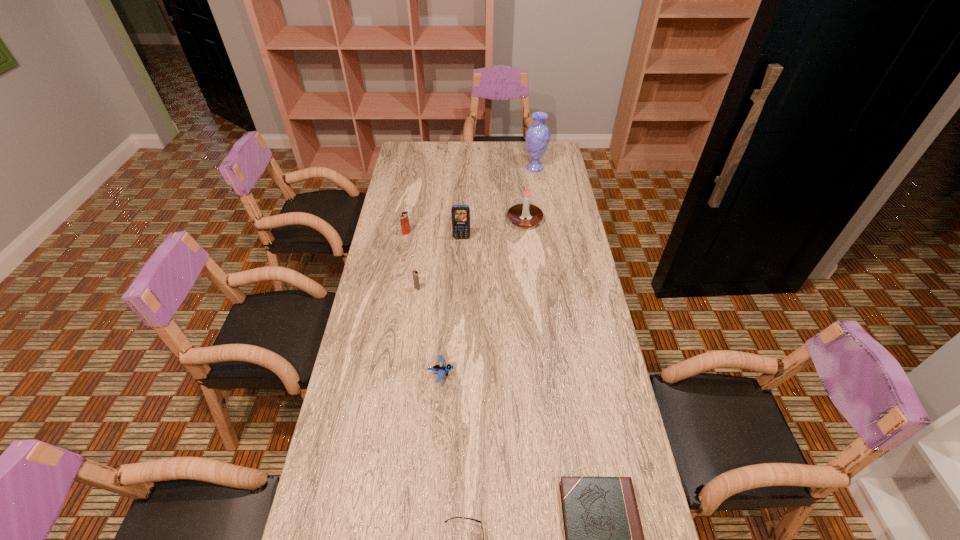
The height and width of the screenshot is (540, 960). Find the location of `object that is at the far right corner`. object that is at the far right corner is located at coordinates tap(537, 136).

In the image, there is a desktop. Identify the location of vacant space at the far edge. This screenshot has width=960, height=540. pyautogui.click(x=483, y=159).

The width and height of the screenshot is (960, 540). Find the location of `vacant space at the left edge of the desktop`. vacant space at the left edge of the desktop is located at coordinates (420, 186).

Identify the location of vacant region at the right edge of the desktop. (542, 237).

Where is `vacant space that's between the candle and the nearer igniter`? The height and width of the screenshot is (540, 960). vacant space that's between the candle and the nearer igniter is located at coordinates (471, 254).

This screenshot has width=960, height=540. In order to click on free space between the vase and the cellular telephone in this screenshot , I will do tap(498, 202).

Where is `empty space that is in between the nearer igniter and the candle`? This screenshot has height=540, width=960. empty space that is in between the nearer igniter and the candle is located at coordinates (471, 254).

Locate an element on the screen. The height and width of the screenshot is (540, 960). empty location between the cellular telephone and the nearer igniter is located at coordinates (440, 263).

Locate an element on the screen. Image resolution: width=960 pixels, height=540 pixels. vacant space in between the fifth farthest object and the candle is located at coordinates (471, 254).

Where is `object that stands as the fourth closest to the sunglasses`? This screenshot has height=540, width=960. object that stands as the fourth closest to the sunglasses is located at coordinates (460, 214).